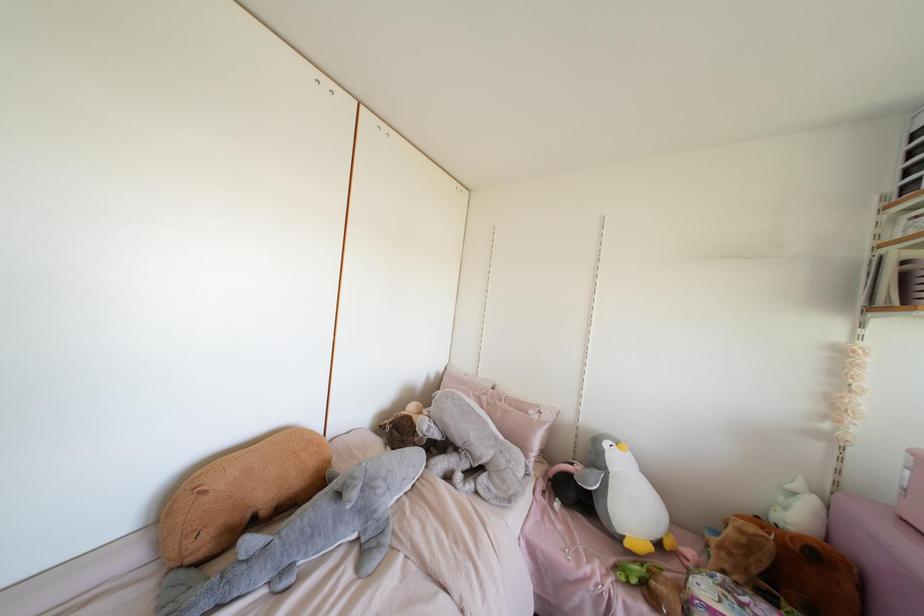
Describe the element at coordinates (892, 260) in the screenshot. I see `a book on shelf` at that location.